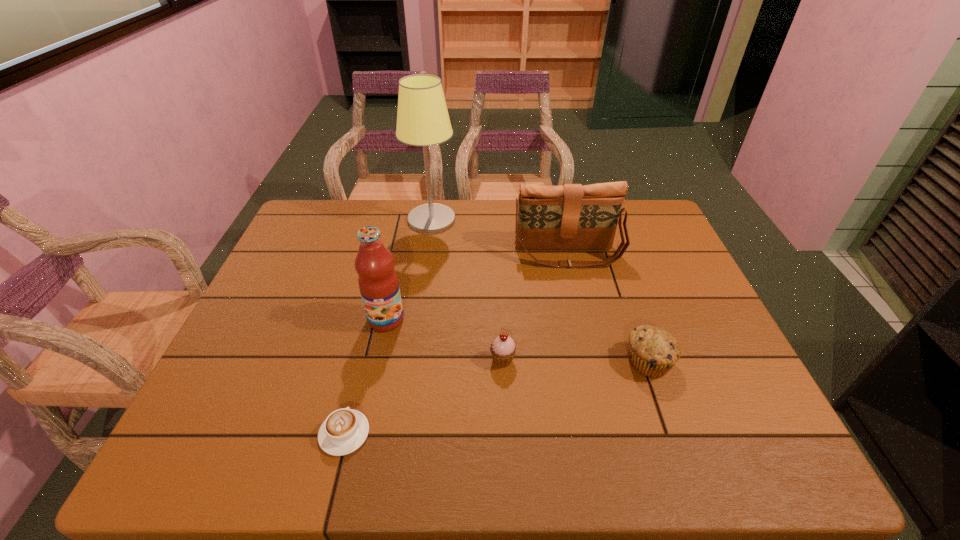
Where is `object situated at the near edge`? This screenshot has height=540, width=960. object situated at the near edge is located at coordinates (344, 430).

Locate an element on the screen. The width and height of the screenshot is (960, 540). object located in the right edge section of the desktop is located at coordinates (652, 351).

Where is `free space at the far edge of the desktop`? free space at the far edge of the desktop is located at coordinates (477, 224).

The height and width of the screenshot is (540, 960). I want to click on vacant region at the near edge of the desktop, so click(555, 467).

Where is `vacant space at the left edge of the desktop`? vacant space at the left edge of the desktop is located at coordinates (321, 288).

At what (x,y) coordinates should I click in order to perform the action: click on free point at the right edge. Please return your answer as a coordinate pair (x, y). The width and height of the screenshot is (960, 540). Looking at the image, I should click on (674, 271).

This screenshot has height=540, width=960. Find the location of `vacant region at the near left corner of the desktop`. vacant region at the near left corner of the desktop is located at coordinates (258, 438).

Where is `blank space at the far right corner of the desktop`? The height and width of the screenshot is (540, 960). blank space at the far right corner of the desktop is located at coordinates (657, 229).

This screenshot has height=540, width=960. Identify the location of vacant area between the cupcake and the tallest object. (468, 290).

Where is `vacant area that lies between the muffin and the shoulder bag`? Image resolution: width=960 pixels, height=540 pixels. vacant area that lies between the muffin and the shoulder bag is located at coordinates (608, 308).